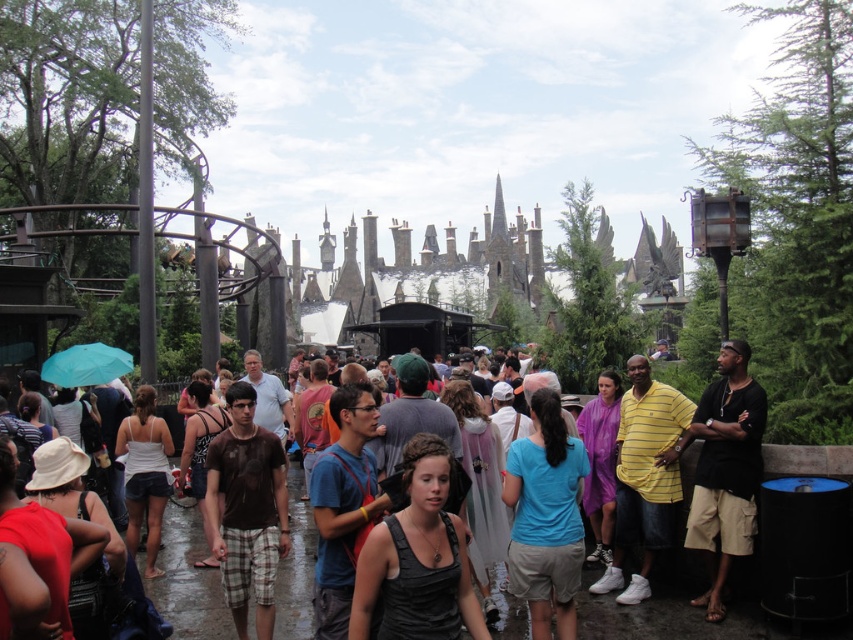
You are a tourist in this theme park and you want to carry both the dark brown leather backpack at center and the teal fabric umbrella at lower left. Which one should you pick up first if you want to put them both on your back?

You should pick up the dark brown leather backpack at center first because it has a larger size compared to the teal fabric umbrella at lower left, so it needs to be placed first to ensure there is enough space for the smaller item.